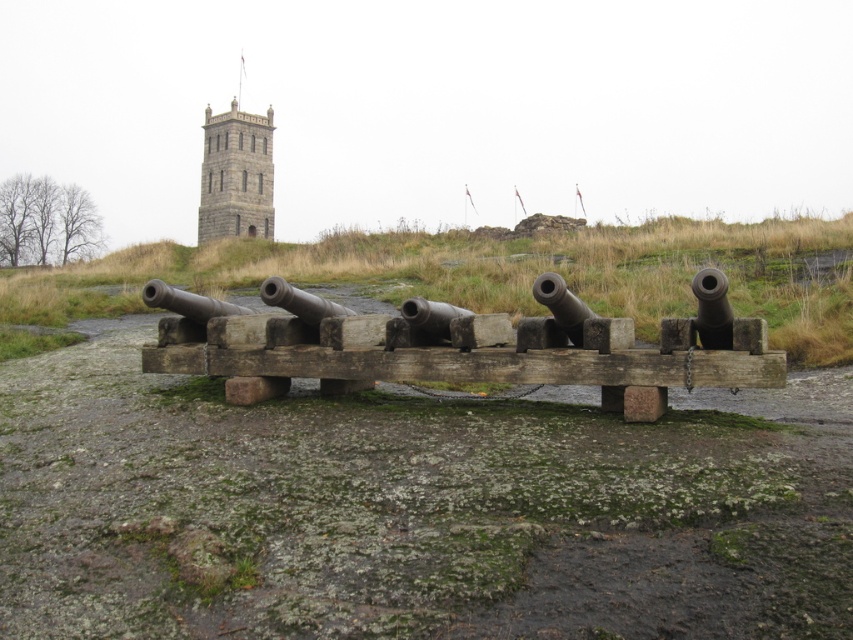
You are a historian measuring distances between historical landmarks. You need to determine if the distance between the rusty metal cannon at center and the stone tower at upper center is over 100 meters. Based on the information provided, what is your conclusion?

The rusty metal cannon at center and the stone tower at upper center are 121.95 meters apart, which is over 100 meters. Therefore, the distance between them exceeds 100 meters.

From the picture: You are a historian examining the cannons on the wooden platform. You notice two cannons at the center. Which cannon is positioned higher, the rusty metal cannon at center or the brass polished cannon at center?

The rusty metal cannon at center is located above the brass polished cannon at center, so it is positioned higher.

You are an engineer inspecting the cannons at the historical site. You notice the rusty metal cannon at center and the brass polished cannon at center. Which cannon is shorter in height?

The rusty metal cannon at center has a lesser height compared to the brass polished cannon at center, so the rusty metal cannon at center is shorter.